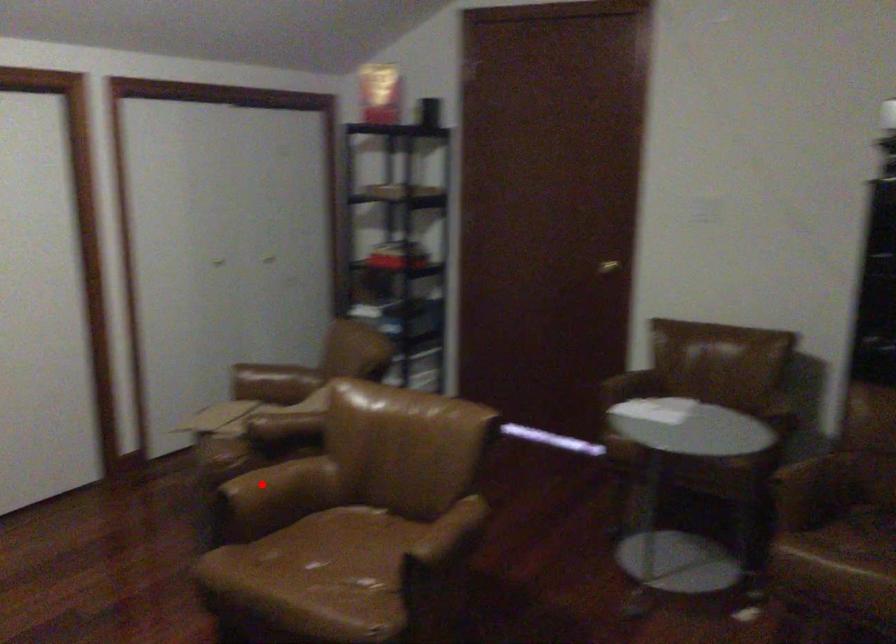
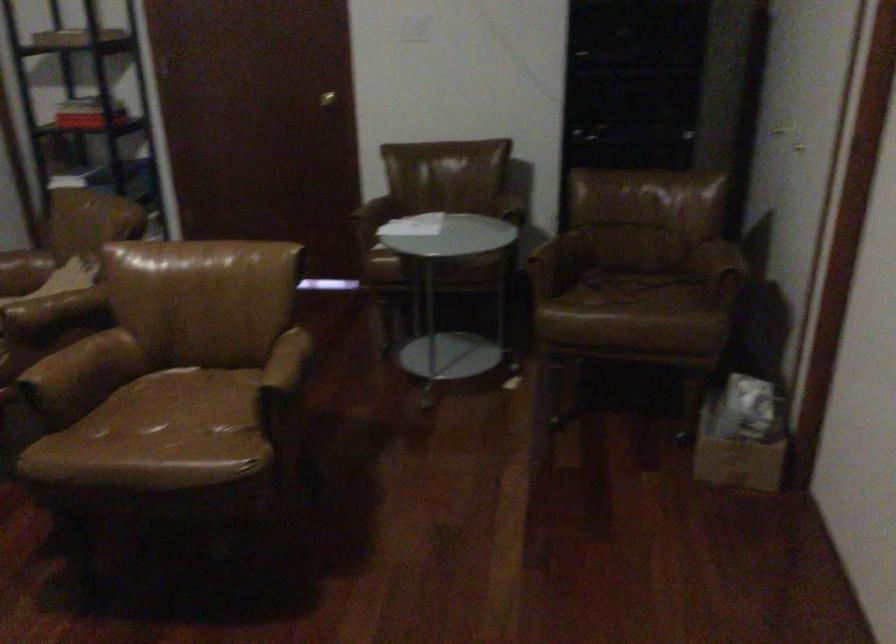
Where in the second image is the point corresponding to the highlighted location from the first image?

(61, 361)